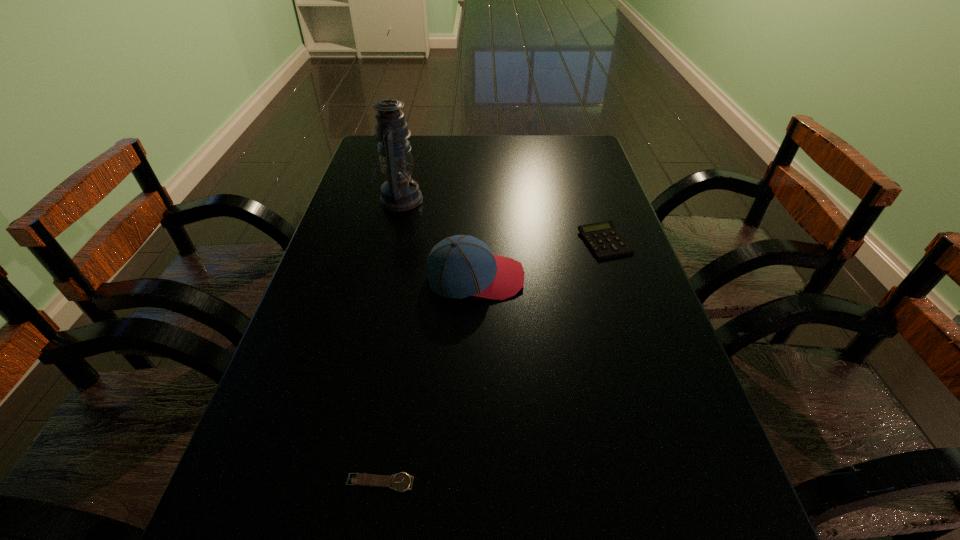
This screenshot has height=540, width=960. Find the location of `free space located 0.070m on the right of the watch`. free space located 0.070m on the right of the watch is located at coordinates (459, 483).

Identify the location of object situated at the left edge. (399, 192).

Where is `object that is at the right edge`? Image resolution: width=960 pixels, height=540 pixels. object that is at the right edge is located at coordinates (604, 240).

Where is `free spot at the far edge of the desktop`? The width and height of the screenshot is (960, 540). free spot at the far edge of the desktop is located at coordinates (431, 144).

Find the location of a particular element. This screenshot has width=960, height=540. vacant space at the left edge is located at coordinates (363, 188).

Identify the location of free space at the right edge of the desktop. This screenshot has width=960, height=540. (632, 310).

What are the coordinates of `vacant space at the far left corner of the desktop` in the screenshot? It's located at (371, 168).

This screenshot has height=540, width=960. Identify the location of vacant space at the far right corner of the desktop. (570, 148).

This screenshot has height=540, width=960. Identify the location of free space that is in between the third tallest object and the lantern. (502, 221).

You are a GUI agent. You are given a task and a screenshot of the screen. Output one action in this format:
    pyautogui.click(x=<x>, y=<y>)
    Task: Click on the unoccupied area between the shortest object and the baseball cap
    The image size is (960, 540).
    Given the screenshot: What is the action you would take?
    pyautogui.click(x=428, y=380)